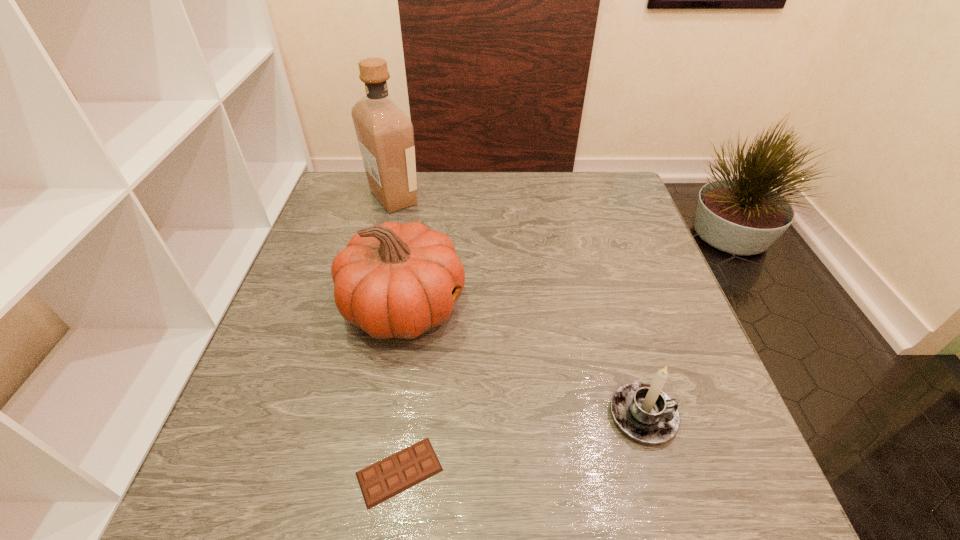
Image resolution: width=960 pixels, height=540 pixels. I want to click on vacant space that satisfies the following two spatial constraints: 1. on the face of the shortest object; 2. on the left side of the third shortest object, so click(377, 471).

Where is `vacant position in the image that satisfies the following two spatial constraints: 1. on the face of the third shortest object; 2. on the back side of the shortest object`? This screenshot has width=960, height=540. vacant position in the image that satisfies the following two spatial constraints: 1. on the face of the third shortest object; 2. on the back side of the shortest object is located at coordinates (377, 471).

Find the location of `vacant point that satisfies the following two spatial constraints: 1. on the front-facing side of the liquor; 2. on the back side of the shortest object`. vacant point that satisfies the following two spatial constraints: 1. on the front-facing side of the liquor; 2. on the back side of the shortest object is located at coordinates (325, 471).

Where is `blank area in the image that satisfies the following two spatial constraints: 1. with a handle on the side of the rightmost object; 2. on the front side of the chocolate bar`? The height and width of the screenshot is (540, 960). blank area in the image that satisfies the following two spatial constraints: 1. with a handle on the side of the rightmost object; 2. on the front side of the chocolate bar is located at coordinates (659, 471).